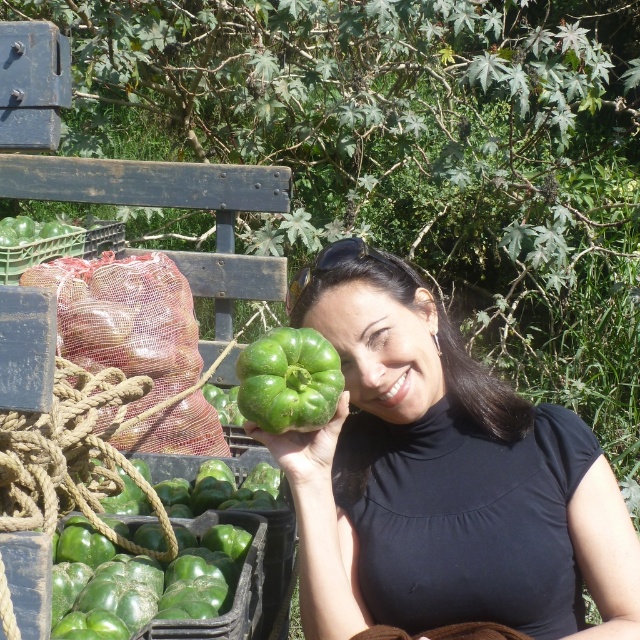
You are an AI analyzing the image. Please report the 2D coordinates of the green matte pepper at center in the format of a tuple like this, for example, like this format is correct? Please confirm if the coordinates provided in the description are accurate.

The 2D coordinates of the green matte pepper at center are indeed at point (442, 477) as stated in the description.

The woman is holding two green peppers in the image. One is labeled as a green matte pepper at center and the other as a green matte bell pepper at center. Which one is positioned lower?

The green matte pepper at center is located below the green matte bell pepper at center, so the green matte pepper at center is positioned lower.

The woman is holding two peppers, a green matte pepper at center and a green matte bell pepper at center. Which one is bigger?

The green matte pepper at center is larger in size than the green matte bell pepper at center.